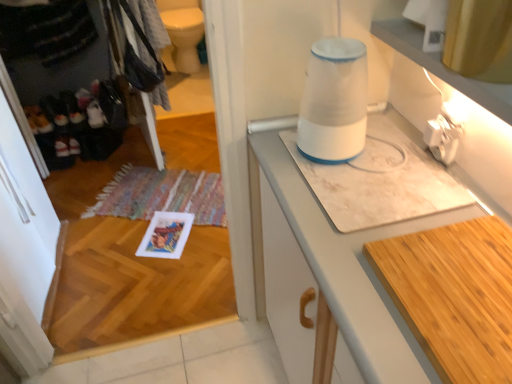
Where is `free space above wooden cutting board at lower right (from a real-world perspective)`? free space above wooden cutting board at lower right (from a real-world perspective) is located at coordinates (465, 291).